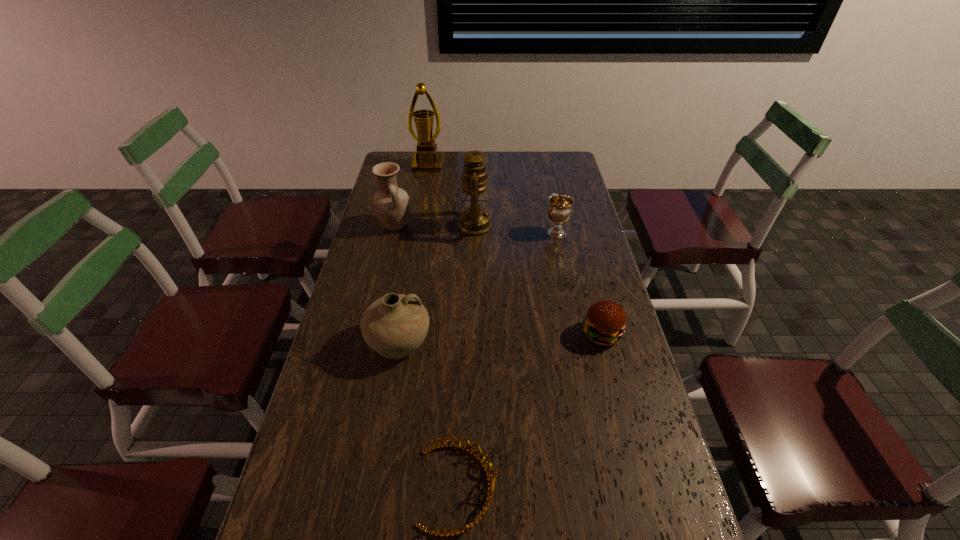
In the image, there is a desktop. Where is `vacant area at the far edge`? The height and width of the screenshot is (540, 960). vacant area at the far edge is located at coordinates (511, 173).

Locate an element on the screen. This screenshot has height=540, width=960. vacant space at the left edge of the desktop is located at coordinates (357, 403).

Identify the location of vacant area at the right edge of the desktop. (561, 274).

In the image, there is a desktop. Where is `free space at the far right corner`? free space at the far right corner is located at coordinates (558, 156).

Locate an element on the screen. free spot between the award and the nearer pottery is located at coordinates (414, 254).

What are the coordinates of `vacant area between the oil lamp and the hamburger` in the screenshot? It's located at (538, 280).

Locate an element on the screen. This screenshot has width=960, height=540. free space between the taller pottery and the hamburger is located at coordinates (498, 280).

I want to click on object that is the sixth closest to the sixth shortest object, so click(491, 479).

Where is `object that is the fifth closest to the sixth tallest object`? The image size is (960, 540). object that is the fifth closest to the sixth tallest object is located at coordinates (392, 205).

At what (x,y) coordinates should I click in order to perform the action: click on free space in the image that satisfies the following two spatial constraints: 1. on the front-facing side of the farthest object; 2. on the right side of the fifth tallest object. Please return your answer as a coordinate pair (x, y). The height and width of the screenshot is (540, 960). Looking at the image, I should click on (417, 233).